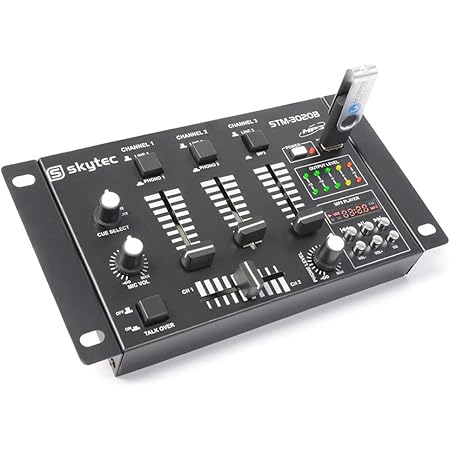
Find the location of `yellow led light`. yellow led light is located at coordinates (338, 168).